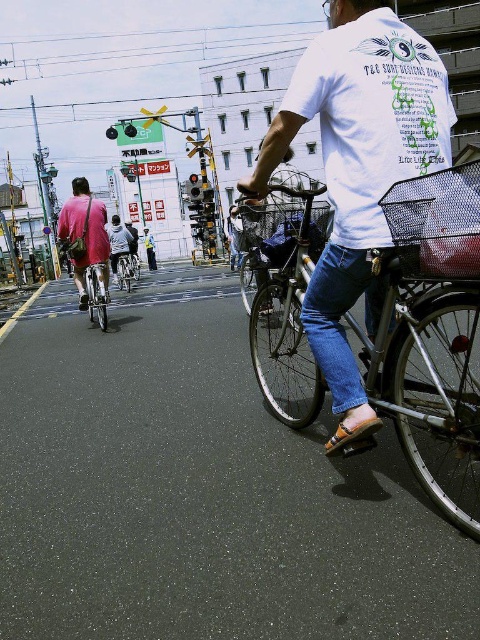
You are a delivery person who needs to place a package in the metallic mesh basket at center. The package is taller than the light blue jeans at center. Will the package fit in the basket?

The metallic mesh basket at center is not as tall as the light blue jeans at center. Since the package is taller than the jeans, it will not fit in the basket.

You are a delivery person needing to secure a package on your bicycle. You see the metallic mesh basket at center and the light blue jeans at center. Which object is positioned lower from the ground?

The metallic mesh basket at center is located below light blue jeans at center, so it is positioned lower from the ground.

You are standing at the railway crossing and see the silver metallic bicycle at center. If you want to reach it quickly, how many steps would you estimate you need to take?

The silver metallic bicycle at center is 36.95 feet away from viewer. Assuming an average step length of about 2.5 feet, you would need approximately 15 steps to reach it.